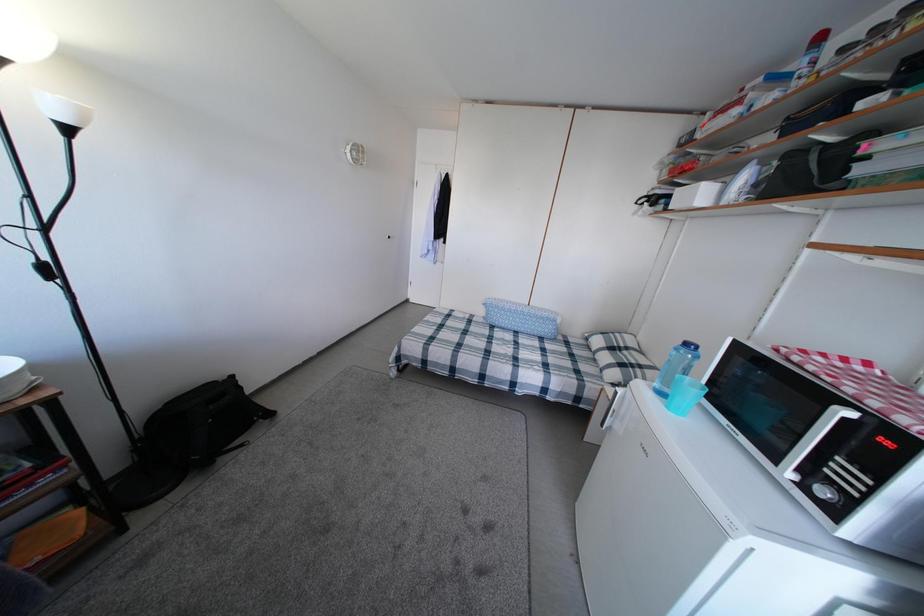
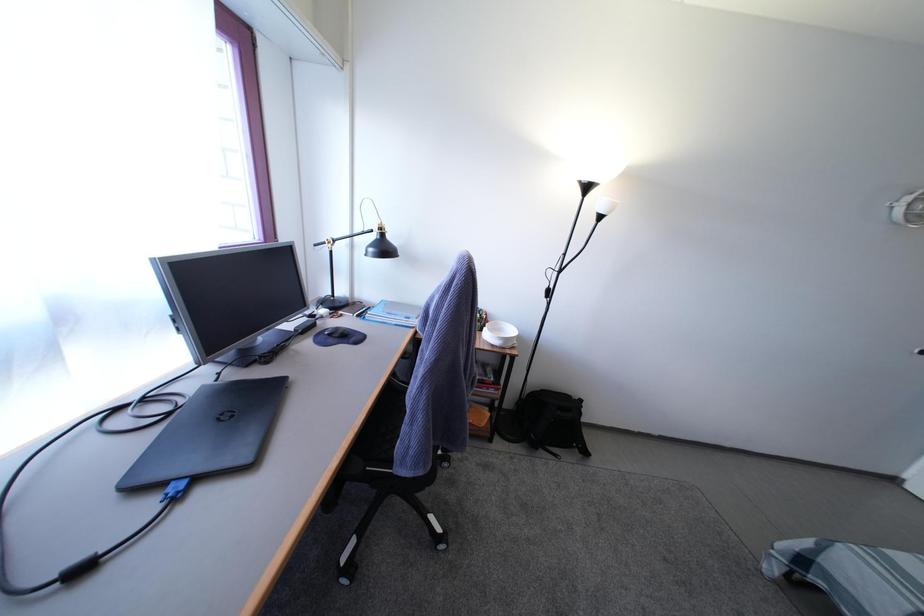
Question: The camera is either moving clockwise (left) or counter-clockwise (right) around the object. The first image is from the beginning of the video and the second image is from the end. Is the camera moving left or right when shooting the video?

Choices:
 (A) Left
 (B) Right

Answer: (B)